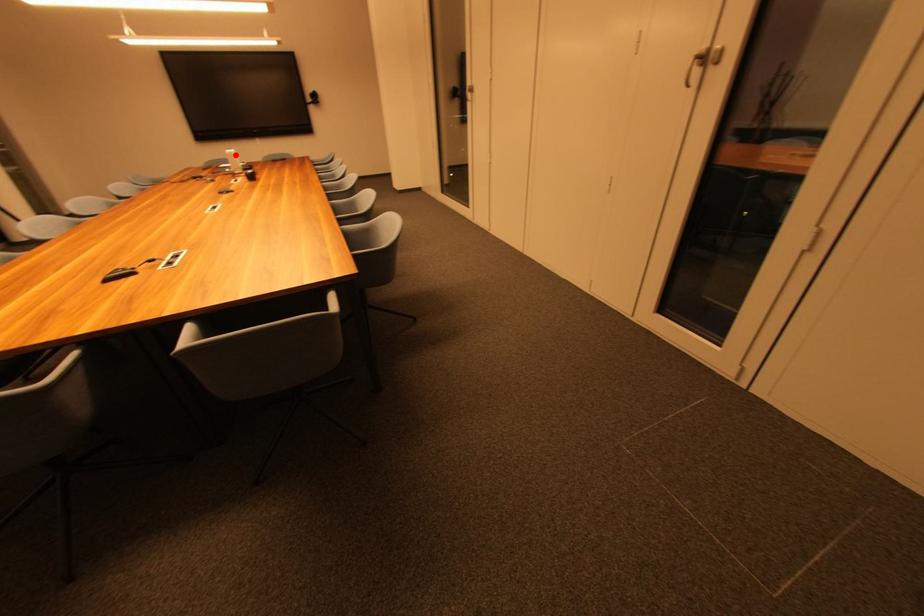
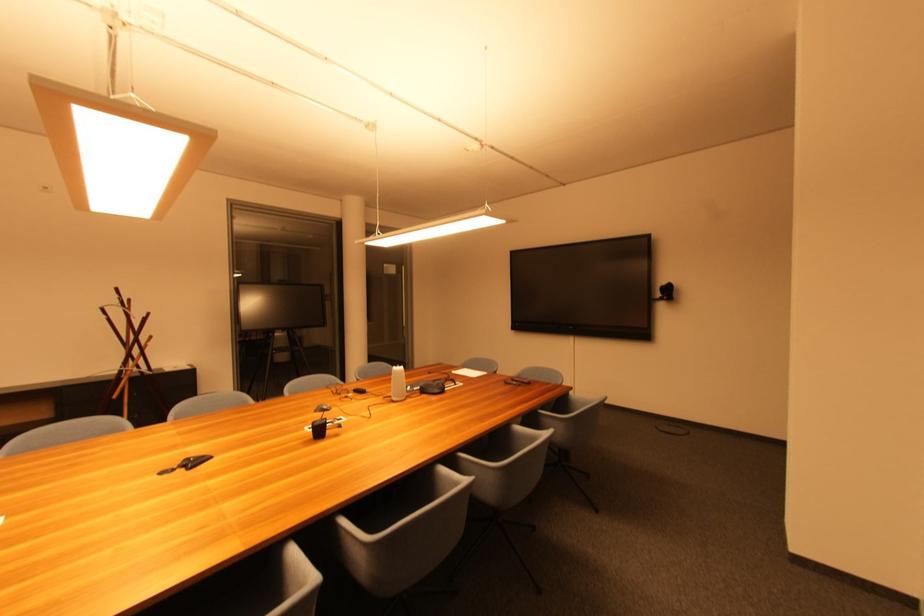
The point at the highlighted location is marked in the first image. Where is the corresponding point in the second image?

(399, 373)